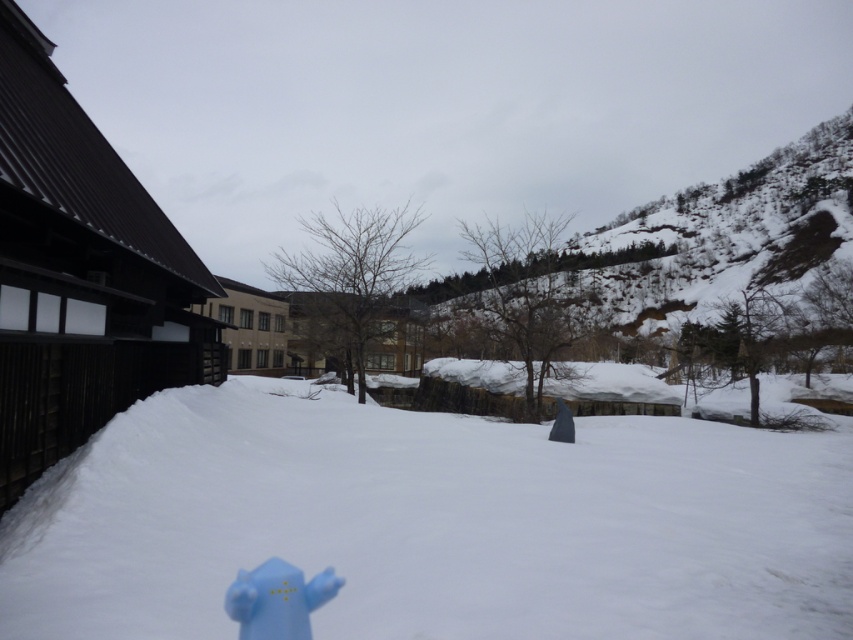
Question: Which object appears farthest from the camera in this image?

Choices:
 (A) white fluffy snow at center
 (B) blue matte fire hydrant at lower left

Answer: (A)

Question: Is white fluffy snow at center to the left of blue matte fire hydrant at lower left from the viewer's perspective?

Choices:
 (A) yes
 (B) no

Answer: (B)

Question: Can you confirm if white fluffy snow at center is positioned above blue matte fire hydrant at lower left?

Choices:
 (A) no
 (B) yes

Answer: (A)

Question: Is white fluffy snow at center behind blue matte fire hydrant at lower left?

Choices:
 (A) no
 (B) yes

Answer: (B)

Question: Among these objects, which one is nearest to the camera?

Choices:
 (A) blue matte fire hydrant at lower left
 (B) white fluffy snow at center

Answer: (A)

Question: Which object appears farthest from the camera in this image?

Choices:
 (A) white fluffy snow at center
 (B) blue matte fire hydrant at lower left

Answer: (A)